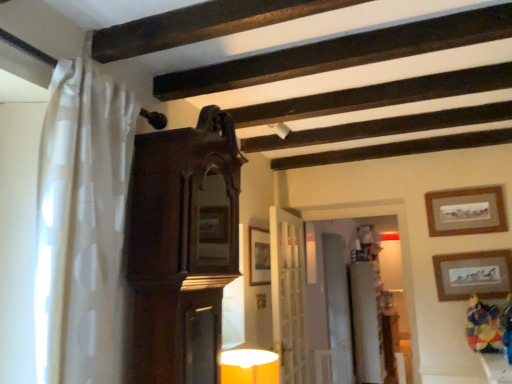
What do you see at coordinates (259, 256) in the screenshot? Image resolution: width=512 pixels, height=384 pixels. I see `wooden picture frame at center, acting as the third picture frame starting from the right` at bounding box center [259, 256].

I want to click on matte gold picture frame at upper right, placed as the 3th picture frame when sorted from left to right, so click(473, 275).

Find the location of a particular element. This screenshot has height=384, width=512. white wooden door at center is located at coordinates (288, 295).

Where is `dark wood cabinet at center`? dark wood cabinet at center is located at coordinates (182, 247).

At what (x,y) coordinates should I click in order to perform the action: click on wooden framed picture at upper right, positioned as the second picture frame in right-to-left order. Please return your answer as a coordinate pair (x, y). Looking at the image, I should click on (466, 211).

Locate an element on the screen. wooden picture frame at center, acting as the third picture frame starting from the right is located at coordinates (259, 256).

What's the angular difference between matte gold picture frame at upper right, placed as the 3th picture frame when sorted from left to right, and white glossy dresser at center's facing directions?

91.2 degrees.

Considering the points (462, 268) and (388, 365), which point is in front, point (462, 268) or point (388, 365)?

The point (462, 268) is in front.

Locate an element on the screen. This screenshot has height=384, width=512. dresser that is on the right side of matte gold picture frame at upper right, the 1th picture frame positioned from the right is located at coordinates (371, 313).

Is white glossy dresser at center surrounded by matte gold picture frame at upper right, the 1th picture frame positioned from the right?

No, white glossy dresser at center is not surrounded by matte gold picture frame at upper right, the 1th picture frame positioned from the right.

Considering the sizes of matte gold picture frame at upper right, placed as the 3th picture frame when sorted from left to right, and matte yellow glass table lamp at lower center in the image, is matte gold picture frame at upper right, placed as the 3th picture frame when sorted from left to right, bigger or smaller than matte yellow glass table lamp at lower center?

Clearly, matte gold picture frame at upper right, placed as the 3th picture frame when sorted from left to right, is smaller in size than matte yellow glass table lamp at lower center.

Is matte gold picture frame at upper right, the 1th picture frame positioned from the right, located outside matte yellow glass table lamp at lower center?

Yes, matte gold picture frame at upper right, the 1th picture frame positioned from the right, is located beyond the bounds of matte yellow glass table lamp at lower center.

Is matte yellow glass table lamp at lower center at the back of matte gold picture frame at upper right, placed as the 3th picture frame when sorted from left to right?

No.

Does point (497, 291) appear closer or farther from the camera than point (268, 373)?

Point (497, 291) is farther from the camera than point (268, 373).

From the image's perspective, between matte yellow glass table lamp at lower center and dark wood cabinet at center, who is located below?

matte yellow glass table lamp at lower center, from the image's perspective.

Does matte yellow glass table lamp at lower center lie in front of dark wood cabinet at center?

No.

Is matte yellow glass table lamp at lower center aimed at dark wood cabinet at center?

No, matte yellow glass table lamp at lower center is not turned towards dark wood cabinet at center.

Who is smaller, matte yellow glass table lamp at lower center or dark wood cabinet at center?

matte yellow glass table lamp at lower center is smaller.

From the image's perspective, which one is positioned lower, dark wood cabinet at center or white sheer curtain at left?

dark wood cabinet at center is shown below in the image.

What's the angular difference between dark wood cabinet at center and white sheer curtain at left's facing directions?

The angle between the facing direction of dark wood cabinet at center and the facing direction of white sheer curtain at left is 0.356 degrees.

Is white sheer curtain at left at the back of dark wood cabinet at center?

dark wood cabinet at center does not have its back to white sheer curtain at left.

Is point (161, 158) farther from viewer compared to point (47, 150)?

Yes, it is behind point (47, 150).

Identify the location of shower curtain that is above the dark wood cabinet at center (from the image's perspective). [82, 224].

Which object is further away from the camera taking this photo, white sheer curtain at left or dark wood cabinet at center?

dark wood cabinet at center is further from the camera.

Measure the distance between white sheer curtain at left and dark wood cabinet at center.

They are 12.45 inches apart.

Is white sheer curtain at left turned away from dark wood cabinet at center?

No.

Can you confirm if wooden picture frame at center, which ranks as the 1th picture frame in left-to-right order, is positioned to the left of white sheer curtain at left?

No, wooden picture frame at center, which ranks as the 1th picture frame in left-to-right order, is not to the left of white sheer curtain at left.

Measure the distance between wooden picture frame at center, acting as the third picture frame starting from the right, and white sheer curtain at left.

They are 1.68 meters apart.

From a real-world perspective, does wooden picture frame at center, which ranks as the 1th picture frame in left-to-right order, stand above white sheer curtain at left?

No, from a real-world perspective, wooden picture frame at center, which ranks as the 1th picture frame in left-to-right order, is not on top of white sheer curtain at left.

Considering the relative sizes of wooden picture frame at center, which ranks as the 1th picture frame in left-to-right order, and white sheer curtain at left in the image provided, is wooden picture frame at center, which ranks as the 1th picture frame in left-to-right order, smaller than white sheer curtain at left?

Yes, wooden picture frame at center, which ranks as the 1th picture frame in left-to-right order, is smaller than white sheer curtain at left.

How many degrees apart are the facing directions of wooden framed picture at upper right, the second picture frame viewed from the left, and matte gold picture frame at upper right, the 1th picture frame positioned from the right?

They differ by 0.571 degrees in their facing directions.

Between wooden framed picture at upper right, the second picture frame viewed from the left, and matte gold picture frame at upper right, placed as the 3th picture frame when sorted from left to right, which one appears on the right side from the viewer's perspective?

matte gold picture frame at upper right, placed as the 3th picture frame when sorted from left to right, is more to the right.

From the matte gold picture frame at upper right, placed as the 3th picture frame when sorted from left to right, count 1st picture frames backward and point to it. Please provide its 2D coordinates.

[(466, 211)]

Is wooden framed picture at upper right, positioned as the second picture frame in right-to-left order, placed right next to matte gold picture frame at upper right, placed as the 3th picture frame when sorted from left to right?

wooden framed picture at upper right, positioned as the second picture frame in right-to-left order, and matte gold picture frame at upper right, placed as the 3th picture frame when sorted from left to right, are clearly separated.

At what (x,y) coordinates should I click in order to perform the action: click on dresser behind the matte gold picture frame at upper right, placed as the 3th picture frame when sorted from left to right. Please return your answer as a coordinate pair (x, y). This screenshot has height=384, width=512. Looking at the image, I should click on (371, 313).

Where is `table lamp below the matte gold picture frame at upper right, the 1th picture frame positioned from the right (from a real-world perspective)`? Image resolution: width=512 pixels, height=384 pixels. table lamp below the matte gold picture frame at upper right, the 1th picture frame positioned from the right (from a real-world perspective) is located at coordinates (249, 366).

Based on the photo, from the image, which object appears to be farther from matte gold picture frame at upper right, the 1th picture frame positioned from the right, white wooden door at center or matte yellow glass table lamp at lower center?

Based on the image, matte yellow glass table lamp at lower center appears to be further to matte gold picture frame at upper right, the 1th picture frame positioned from the right.

Estimate the real-world distances between objects in this image. Which object is further from white sheer curtain at left, wooden framed picture at upper right, the second picture frame viewed from the left, or matte yellow glass table lamp at lower center?

wooden framed picture at upper right, the second picture frame viewed from the left, is further to white sheer curtain at left.

When comparing their distances from matte gold picture frame at upper right, placed as the 3th picture frame when sorted from left to right, does white glossy dresser at center or wooden picture frame at center, acting as the third picture frame starting from the right, seem further?

white glossy dresser at center.

Which object lies further to the anchor point white sheer curtain at left, wooden framed picture at upper right, positioned as the second picture frame in right-to-left order, or white wooden door at center?

wooden framed picture at upper right, positioned as the second picture frame in right-to-left order.

When comparing their distances from matte yellow glass table lamp at lower center, does dark wood cabinet at center or wooden framed picture at upper right, the second picture frame viewed from the left, seem further?

Among the two, wooden framed picture at upper right, the second picture frame viewed from the left, is located further to matte yellow glass table lamp at lower center.

Which object lies further to the anchor point wooden framed picture at upper right, positioned as the second picture frame in right-to-left order, matte gold picture frame at upper right, placed as the 3th picture frame when sorted from left to right, or white wooden door at center?

white wooden door at center.

From the image, which object appears to be nearer to matte gold picture frame at upper right, the 1th picture frame positioned from the right, white sheer curtain at left or wooden picture frame at center, acting as the third picture frame starting from the right?

Among the two, wooden picture frame at center, acting as the third picture frame starting from the right, is located nearer to matte gold picture frame at upper right, the 1th picture frame positioned from the right.

Which object lies further to the anchor point matte yellow glass table lamp at lower center, matte gold picture frame at upper right, the 1th picture frame positioned from the right, or wooden picture frame at center, acting as the third picture frame starting from the right?

The object further to matte yellow glass table lamp at lower center is matte gold picture frame at upper right, the 1th picture frame positioned from the right.

This screenshot has height=384, width=512. Identify the location of door located between wooden picture frame at center, which ranks as the 1th picture frame in left-to-right order, and matte gold picture frame at upper right, placed as the 3th picture frame when sorted from left to right, in the left-right direction. (288, 295).

You are a GUI agent. You are given a task and a screenshot of the screen. Output one action in this format:
    pyautogui.click(x=<x>, y=<y>)
    Task: Click on the door between matte yellow glass table lamp at lower center and wooden picture frame at center, which ranks as the 1th picture frame in left-to-right order, along the z-axis
    
    Given the screenshot: What is the action you would take?
    pyautogui.click(x=288, y=295)

Find the location of a particular element. This screenshot has width=512, height=384. door located between wooden picture frame at center, acting as the third picture frame starting from the right, and wooden framed picture at upper right, the second picture frame viewed from the left, in the left-right direction is located at coordinates click(x=288, y=295).

You are a GUI agent. You are given a task and a screenshot of the screen. Output one action in this format:
    pyautogui.click(x=<x>, y=<y>)
    Task: Click on the table lamp located between white sheer curtain at left and matte gold picture frame at upper right, the 1th picture frame positioned from the right, in the left-right direction
    The width and height of the screenshot is (512, 384).
    Given the screenshot: What is the action you would take?
    [x=249, y=366]